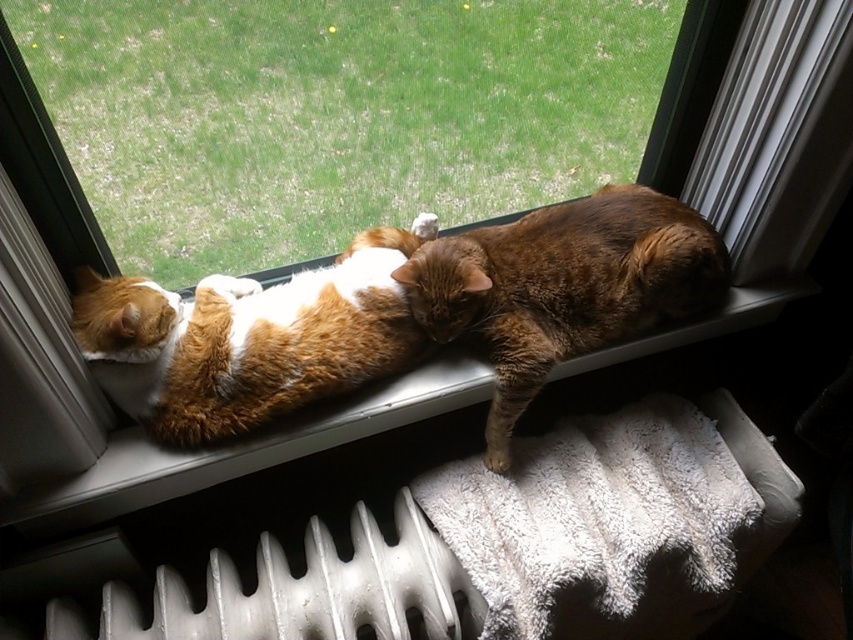
Question: Can you confirm if orange fur cat at center is positioned below white textured window sill at center?

Choices:
 (A) no
 (B) yes

Answer: (A)

Question: Which point is closer to the camera?

Choices:
 (A) tabby fur cat at center
 (B) white textured window sill at center
 (C) orange fur cat at center
 (D) metallic silver radiator at lower left

Answer: (C)

Question: Does orange fur cat at center come in front of white textured window sill at center?

Choices:
 (A) yes
 (B) no

Answer: (A)

Question: Considering the real-world distances, which object is closest to the orange fur cat at center?

Choices:
 (A) metallic silver radiator at lower left
 (B) white textured window sill at center

Answer: (B)

Question: From the image, what is the correct spatial relationship of tabby fur cat at center in relation to metallic silver radiator at lower left?

Choices:
 (A) right
 (B) left

Answer: (A)

Question: Which point is closer to the camera?

Choices:
 (A) metallic silver radiator at lower left
 (B) orange fur cat at center

Answer: (B)